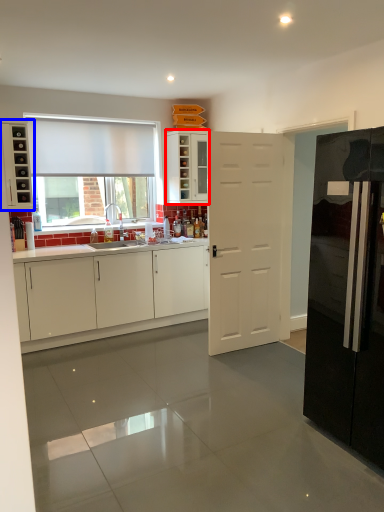
Question: Which point is further to the camera, cabinetry (highlighted by a red box) or cabinetry (highlighted by a blue box)?

Choices:
 (A) cabinetry
 (B) cabinetry

Answer: (A)